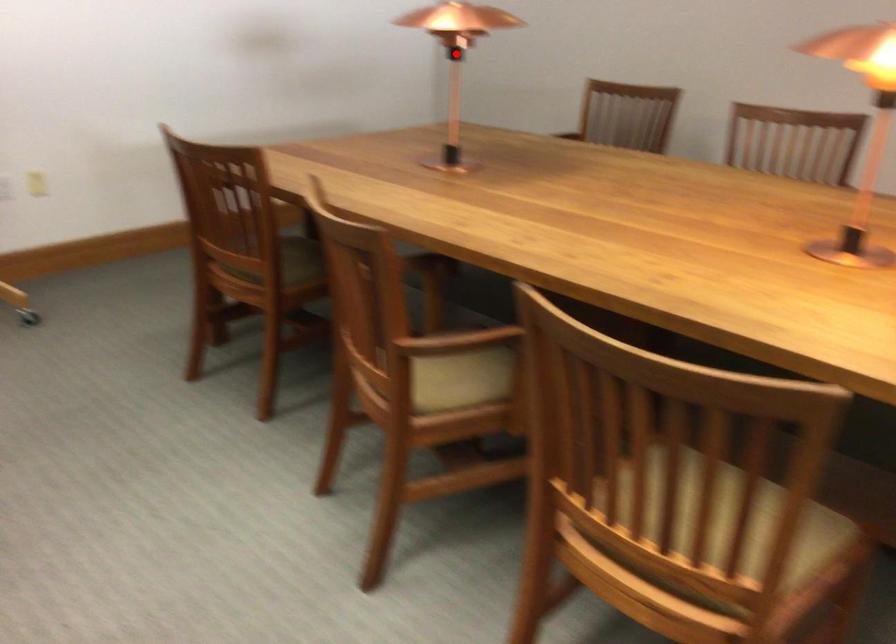
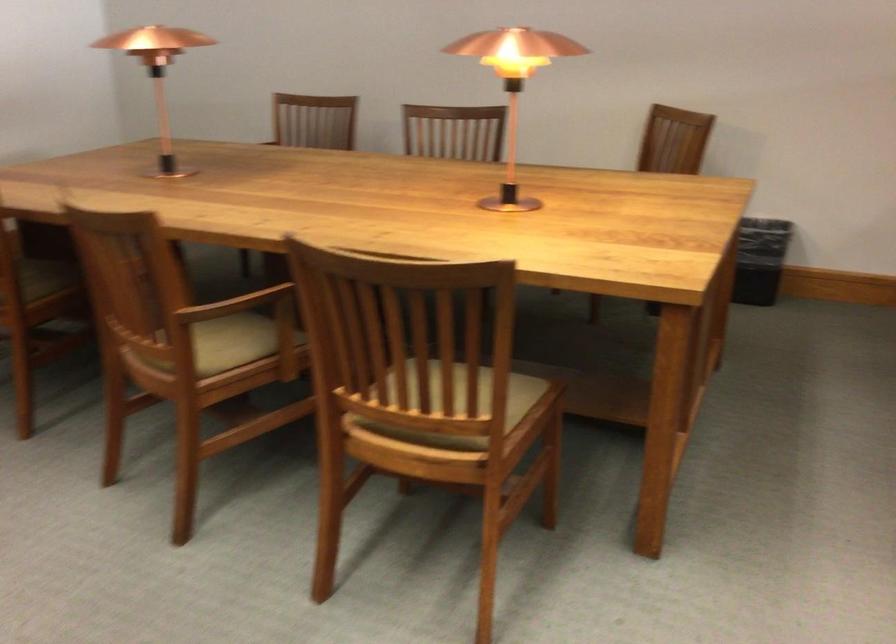
Where in the second image is the point corresponding to the highlighted location from the first image?

(159, 73)